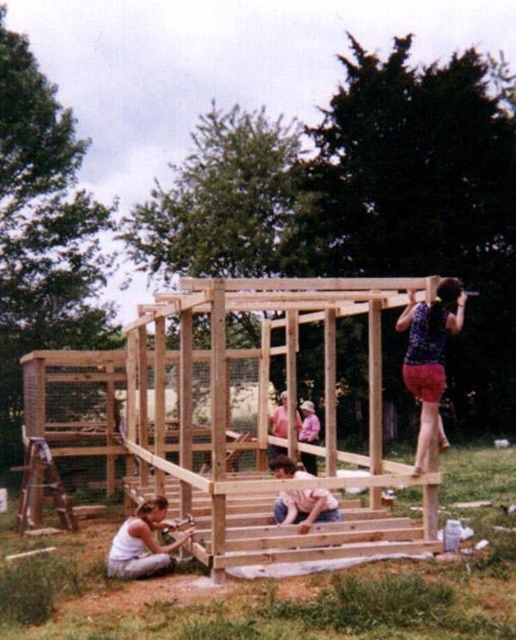
You are a visitor observing the construction site. The light brown wood frame at center and the white fabric construction worker at lower left are in your view. Which object is taller?

The light brown wood frame at center is taller than the white fabric construction worker at lower left according to the description.

Where is the spotted fabric shorts at upper right located in the image?

The spotted fabric shorts at upper right is located at point (429, 355) in the image.